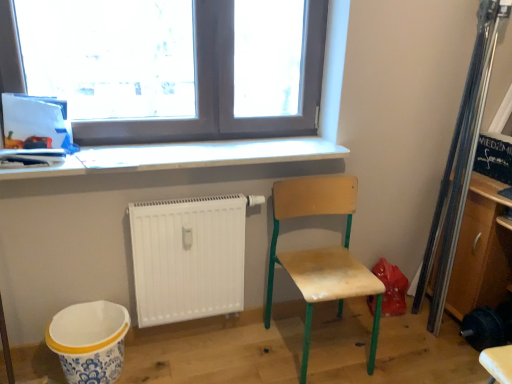
Where is `vacant space to the left of wooden chair at lower right`? This screenshot has width=512, height=384. vacant space to the left of wooden chair at lower right is located at coordinates (240, 357).